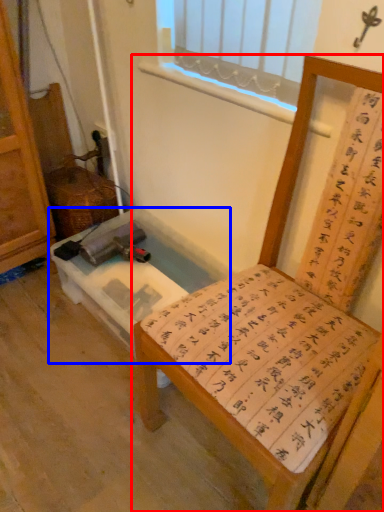
Question: Among these objects, which one is nearest to the camera, furniture (highlighted by a red box) or vanity (highlighted by a blue box)?

Choices:
 (A) furniture
 (B) vanity

Answer: (A)